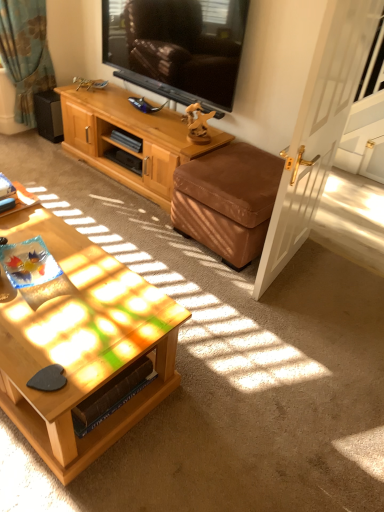
Question: Can we say black glossy television at upper center lies outside light brown wood cabinet at upper center?

Choices:
 (A) no
 (B) yes

Answer: (B)

Question: Is black glossy television at upper center far from light brown wood cabinet at upper center?

Choices:
 (A) no
 (B) yes

Answer: (A)

Question: From a real-world perspective, is black glossy television at upper center on light brown wood cabinet at upper center?

Choices:
 (A) no
 (B) yes

Answer: (B)

Question: Could you tell me if black glossy television at upper center is turned towards light brown wood cabinet at upper center?

Choices:
 (A) yes
 (B) no

Answer: (B)

Question: Is black glossy television at upper center next to light brown wood cabinet at upper center?

Choices:
 (A) no
 (B) yes

Answer: (A)

Question: Would you say light brown wood cabinet at upper center is to the left or to the right of brown leather ottoman at lower right in the picture?

Choices:
 (A) left
 (B) right

Answer: (A)

Question: Is light brown wood cabinet at upper center spatially inside brown leather ottoman at lower right, or outside of it?

Choices:
 (A) outside
 (B) inside

Answer: (A)

Question: Is light brown wood cabinet at upper center in front of or behind brown leather ottoman at lower right in the image?

Choices:
 (A) behind
 (B) front

Answer: (A)

Question: From a real-world perspective, is light brown wood cabinet at upper center positioned above or below brown leather ottoman at lower right?

Choices:
 (A) below
 (B) above

Answer: (B)

Question: Considering their positions, is woodenobject at lower left located in front of or behind brown leather ottoman at lower right?

Choices:
 (A) front
 (B) behind

Answer: (A)

Question: Is woodenobject at lower left spatially inside brown leather ottoman at lower right, or outside of it?

Choices:
 (A) outside
 (B) inside

Answer: (A)

Question: In terms of size, does woodenobject at lower left appear bigger or smaller than brown leather ottoman at lower right?

Choices:
 (A) small
 (B) big

Answer: (B)

Question: From a real-world perspective, is woodenobject at lower left physically located above or below brown leather ottoman at lower right?

Choices:
 (A) above
 (B) below

Answer: (B)

Question: Is point (54, 108) closer or farther from the camera than point (8, 210)?

Choices:
 (A) closer
 (B) farther

Answer: (B)

Question: From the image's perspective, is black matte speaker at left located above or below wooden desk at lower left?

Choices:
 (A) above
 (B) below

Answer: (A)